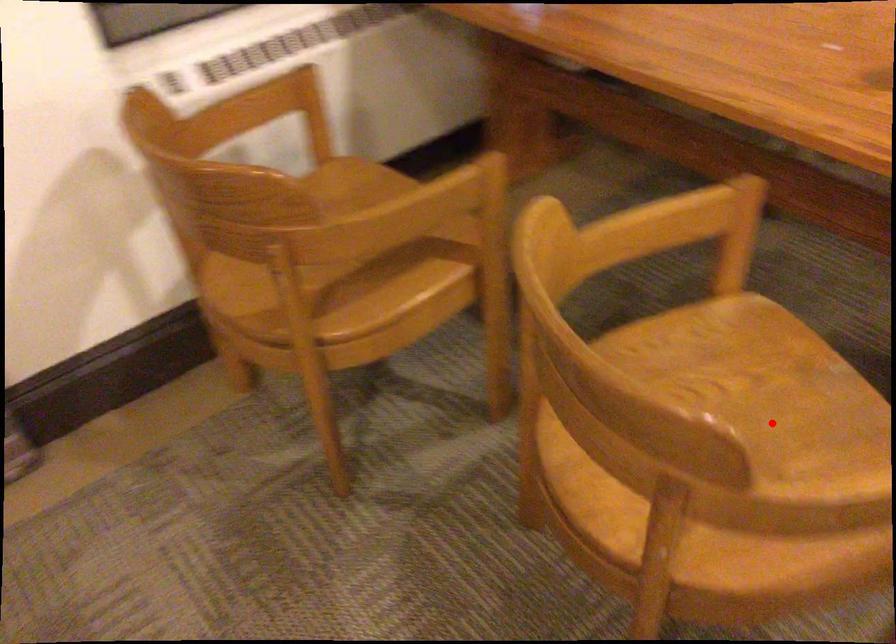
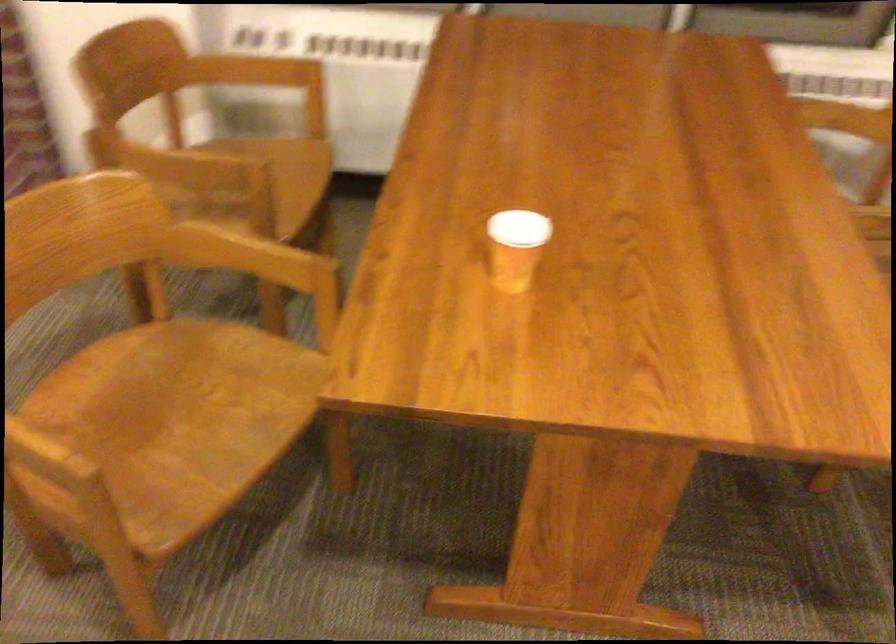
Where in the second image is the point corresponding to the highlighted location from the first image?

(170, 424)